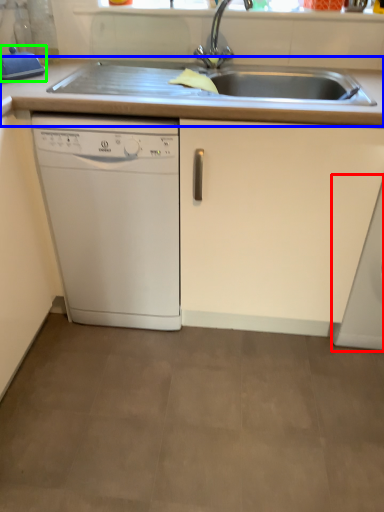
Question: Which object is positioned closest to washing machine (highlighted by a red box)? Select from countertop (highlighted by a blue box) and appliance (highlighted by a green box).

Choices:
 (A) countertop
 (B) appliance

Answer: (A)